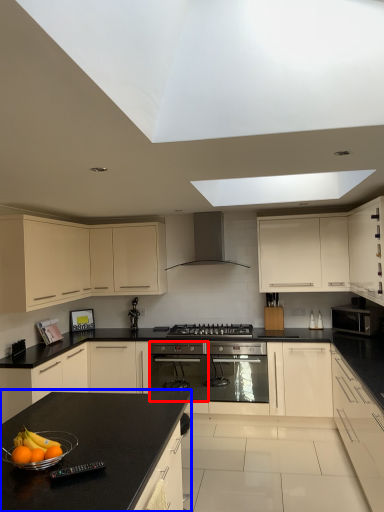
Question: Which object appears farthest to the camera in this image, appliance (highlighted by a red box) or countertop (highlighted by a blue box)?

Choices:
 (A) appliance
 (B) countertop

Answer: (A)